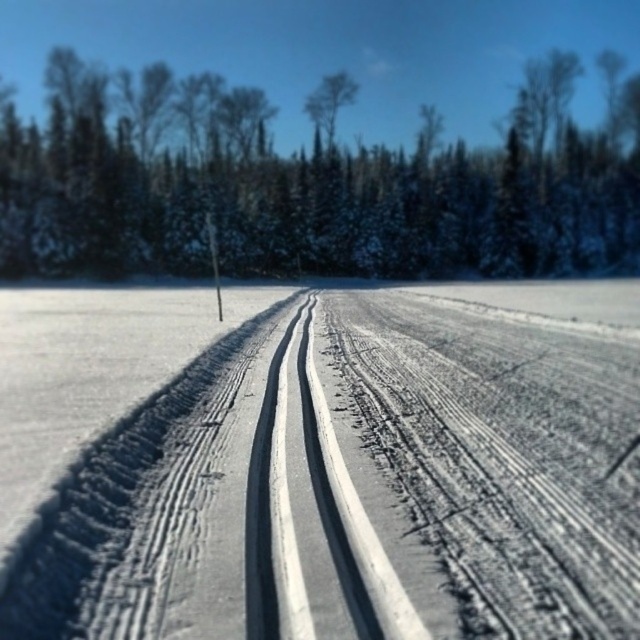
Question: Which of the following is the closest to the observer?

Choices:
 (A) (305, 100)
 (B) (196, 392)
 (C) (84, 161)

Answer: (B)

Question: Estimate the real-world distances between objects in this image. Which object is closer to the gray textured dirt track at center?

Choices:
 (A) green leafy tree at center
 (B) green textured trees at center

Answer: (B)

Question: From the image, what is the correct spatial relationship of green textured trees at center in relation to green leafy tree at center?

Choices:
 (A) below
 (B) above

Answer: (A)

Question: Is the position of green textured trees at center more distant than that of green leafy tree at center?

Choices:
 (A) yes
 (B) no

Answer: (B)

Question: Does gray textured dirt track at center come in front of green leafy tree at center?

Choices:
 (A) yes
 (B) no

Answer: (A)

Question: Based on their relative distances, which object is nearer to the green leafy tree at center?

Choices:
 (A) green textured trees at center
 (B) gray textured dirt track at center

Answer: (A)